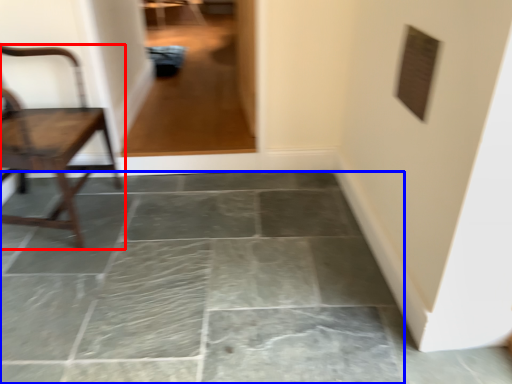
Question: Which of the following is the farthest to the observer, chair (highlighted by a red box) or concrete (highlighted by a blue box)?

Choices:
 (A) chair
 (B) concrete

Answer: (A)